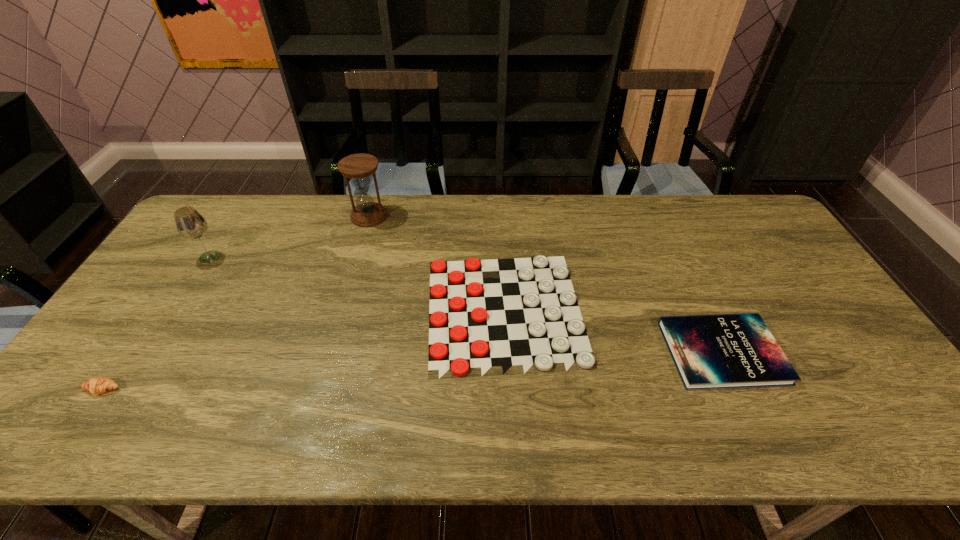
Where is `the third object from right to left`? This screenshot has height=540, width=960. the third object from right to left is located at coordinates (358, 167).

Identify the location of the farthest object. (358, 167).

This screenshot has width=960, height=540. I want to click on wineglass, so 190,224.

This screenshot has height=540, width=960. I want to click on the third tallest object, so click(98, 385).

The width and height of the screenshot is (960, 540). I want to click on the fourth tallest object, so click(722, 351).

Where is `hardback book`? hardback book is located at coordinates (722, 351).

Where is `the fourth object from left to right`? The height and width of the screenshot is (540, 960). the fourth object from left to right is located at coordinates (474, 322).

Locate an element on the screen. the shortest object is located at coordinates (474, 322).

Where is `vacant space located 0.220m on the right of the tallest object`? The height and width of the screenshot is (540, 960). vacant space located 0.220m on the right of the tallest object is located at coordinates coord(451,216).

Where is `free space located 0.180m on the front of the fourth shortest object`? free space located 0.180m on the front of the fourth shortest object is located at coordinates (176, 310).